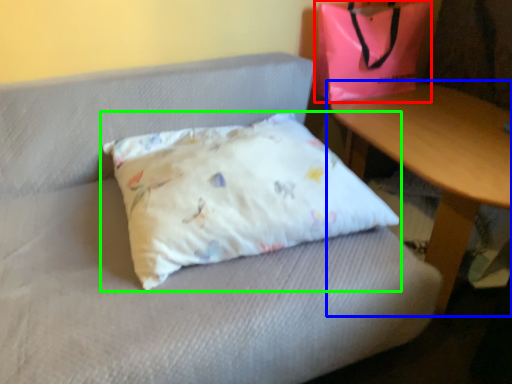
Question: Estimate the real-world distances between objects in this image. Which object is closer to pouch (highlighted by a red box), table (highlighted by a blue box) or pillow (highlighted by a green box)?

Choices:
 (A) table
 (B) pillow

Answer: (A)